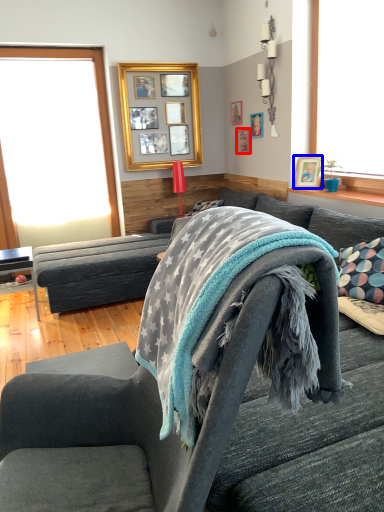
Question: Which point is further to the camera, picture frame (highlighted by a red box) or picture frame (highlighted by a blue box)?

Choices:
 (A) picture frame
 (B) picture frame

Answer: (A)